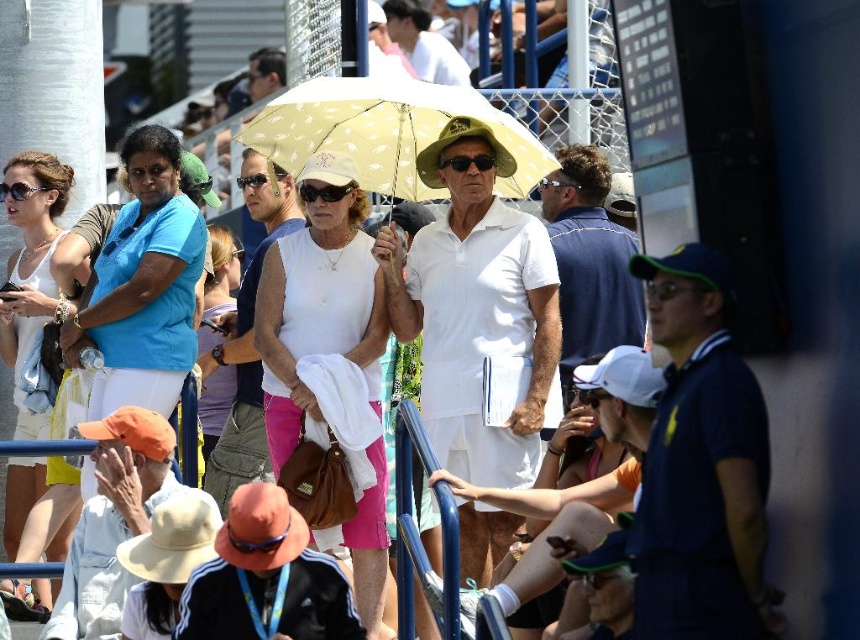
Question: Based on their relative distances, which object is nearer to the matte white tank top at center?

Choices:
 (A) matte black sunglasses at center
 (B) black plastic sunglasses at center
 (C) yellow dotted fabric umbrella at center
 (D) white fabric shirt at center

Answer: (D)

Question: Which of the following is the farthest from the observer?

Choices:
 (A) (341, 152)
 (B) (26, 470)

Answer: (B)

Question: Can you confirm if matte black sunglasses at center is positioned to the left of black plastic sunglasses at center?

Choices:
 (A) yes
 (B) no

Answer: (A)

Question: Is matte white tank top at center smaller than white fabric shirt at center?

Choices:
 (A) yes
 (B) no

Answer: (B)

Question: Which object appears farthest from the camera in this image?

Choices:
 (A) white fabric shirt at center
 (B) matte white tank top at center
 (C) matte black sunglasses at center

Answer: (A)

Question: Can you confirm if matte white tank top at center is positioned above white matte tank top at center?

Choices:
 (A) yes
 (B) no

Answer: (B)